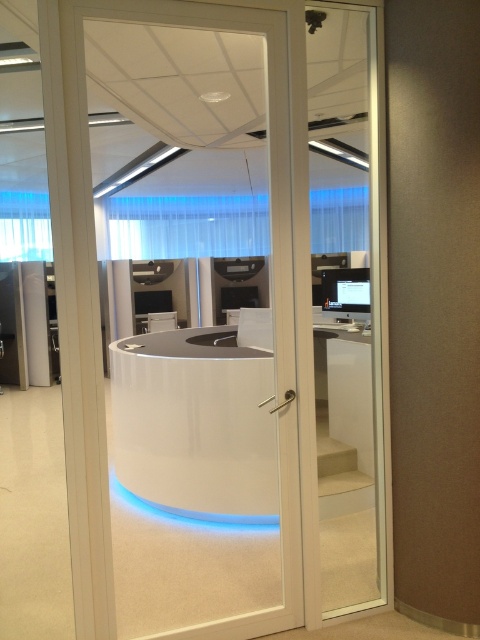
Question: Can you confirm if transparent glass door at center is bigger than matte black monitor at center?

Choices:
 (A) no
 (B) yes

Answer: (B)

Question: Which point appears closest to the camera in this image?

Choices:
 (A) (339, 568)
 (B) (369, 285)

Answer: (A)

Question: Among these objects, which one is farthest from the camera?

Choices:
 (A) transparent glass door at center
 (B) matte black monitor at center

Answer: (B)

Question: Does transparent glass door at center come in front of matte black monitor at center?

Choices:
 (A) no
 (B) yes

Answer: (B)

Question: Observing the image, what is the correct spatial positioning of transparent glass door at center in reference to matte black monitor at center?

Choices:
 (A) above
 (B) below

Answer: (A)